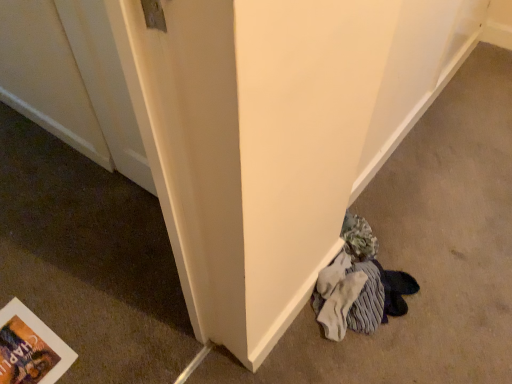
The width and height of the screenshot is (512, 384). I want to click on matte paper magazine at lower left, so click(30, 348).

The width and height of the screenshot is (512, 384). What do you see at coordinates (30, 348) in the screenshot?
I see `matte paper magazine at lower left` at bounding box center [30, 348].

What is the approximate height of matte paper magazine at lower left?

matte paper magazine at lower left is 3.18 centimeters in height.

You are a GUI agent. You are given a task and a screenshot of the screen. Output one action in this format:
    pyautogui.click(x=<x>, y=<y>)
    Task: Click on the matte paper magazine at lower left
    
    Given the screenshot: What is the action you would take?
    pyautogui.click(x=30, y=348)